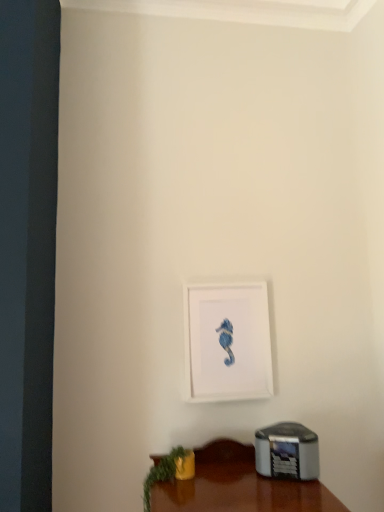
Question: Relative to green leafy plant at lower left, is white matte picture frame at center in front or behind?

Choices:
 (A) front
 (B) behind

Answer: (B)

Question: From their relative heights in the image, would you say white matte picture frame at center is taller or shorter than green leafy plant at lower left?

Choices:
 (A) short
 (B) tall

Answer: (B)

Question: Considering the relative positions of white matte picture frame at center and green leafy plant at lower left in the image provided, is white matte picture frame at center to the left or to the right of green leafy plant at lower left?

Choices:
 (A) right
 (B) left

Answer: (A)

Question: Is point (145, 493) closer or farther from the camera than point (218, 353)?

Choices:
 (A) farther
 (B) closer

Answer: (B)

Question: Is green leafy plant at lower left inside the boundaries of white matte picture frame at center, or outside?

Choices:
 (A) inside
 (B) outside

Answer: (B)

Question: Is green leafy plant at lower left wider or thinner than white matte picture frame at center?

Choices:
 (A) wide
 (B) thin

Answer: (A)

Question: Would you say green leafy plant at lower left is to the left or to the right of white matte picture frame at center in the picture?

Choices:
 (A) left
 (B) right

Answer: (A)